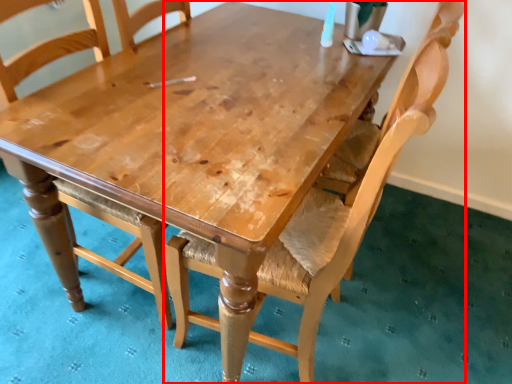
Question: From the image, what is the correct spatial relationship of chair (annotated by the red box) in relation to chair?

Choices:
 (A) right
 (B) left

Answer: (A)